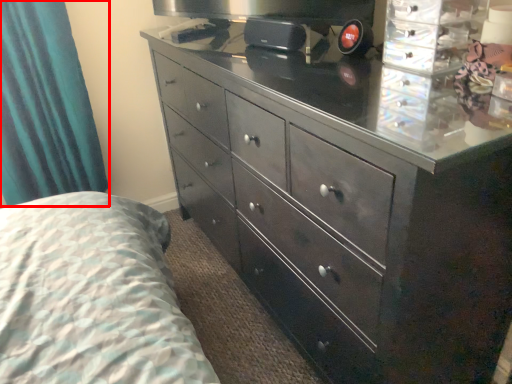
Question: From the image, what is the correct spatial relationship of curtain (annotated by the red box) in relation to chest of drawers?

Choices:
 (A) right
 (B) left

Answer: (B)